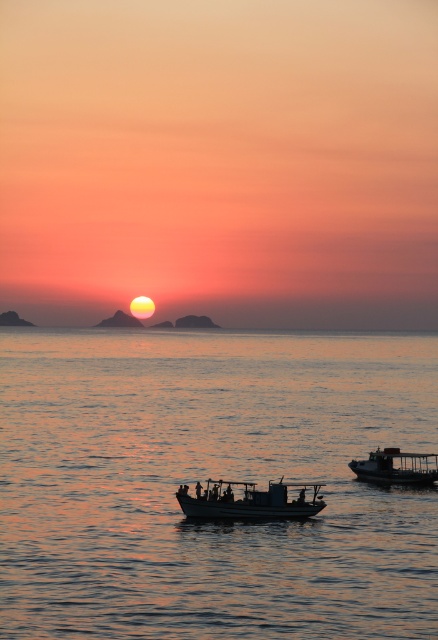
You are standing on the shore looking at the sunset scene. There is a point marked at coordinates (248, 500) in the image. What object is located at that point?

The point at coordinates (248, 500) indicates the white matte boat at center.

From the picture: You are standing on the shore observing the two points on the water labeled as point (64, 548) and point (402, 468). Which point is nearer to you?

Point (64, 548) is closer to the camera than point (402, 468), so the point nearer to you is point (64, 548).